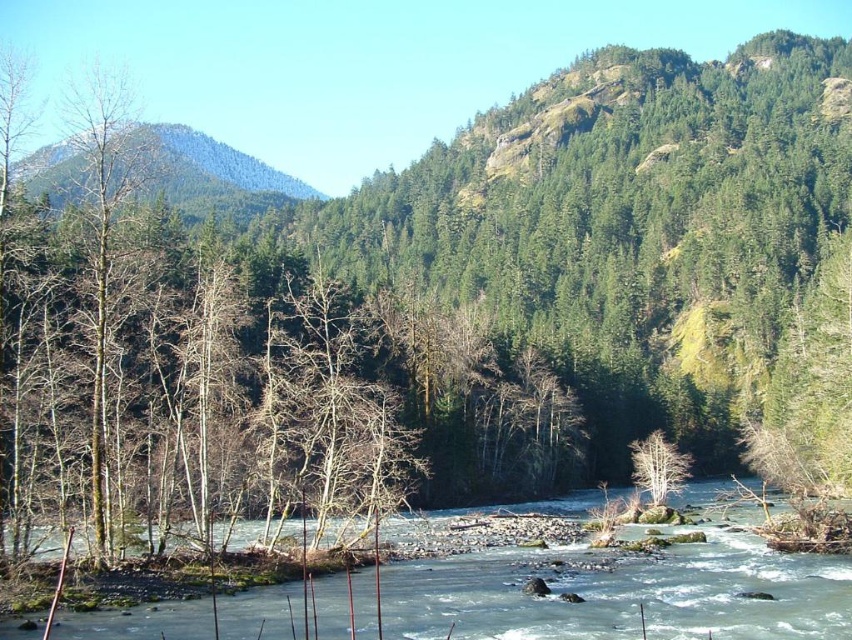
Question: Does green forested mountain at upper left appear under white matte tree at center?

Choices:
 (A) yes
 (B) no

Answer: (B)

Question: Among these points, which one is farthest from the camera?

Choices:
 (A) (65, 195)
 (B) (632, 445)
 (C) (706, 556)

Answer: (A)

Question: Is clear water at center thinner than white matte tree at center?

Choices:
 (A) yes
 (B) no

Answer: (B)

Question: Which object appears closest to the camera in this image?

Choices:
 (A) green forested mountain at upper left
 (B) clear water at center

Answer: (B)

Question: Which object is farther from the camera taking this photo?

Choices:
 (A) white matte tree at center
 (B) clear water at center
 (C) green forested mountain at upper left

Answer: (C)

Question: Is green forested mountain at upper left below white matte tree at center?

Choices:
 (A) no
 (B) yes

Answer: (A)